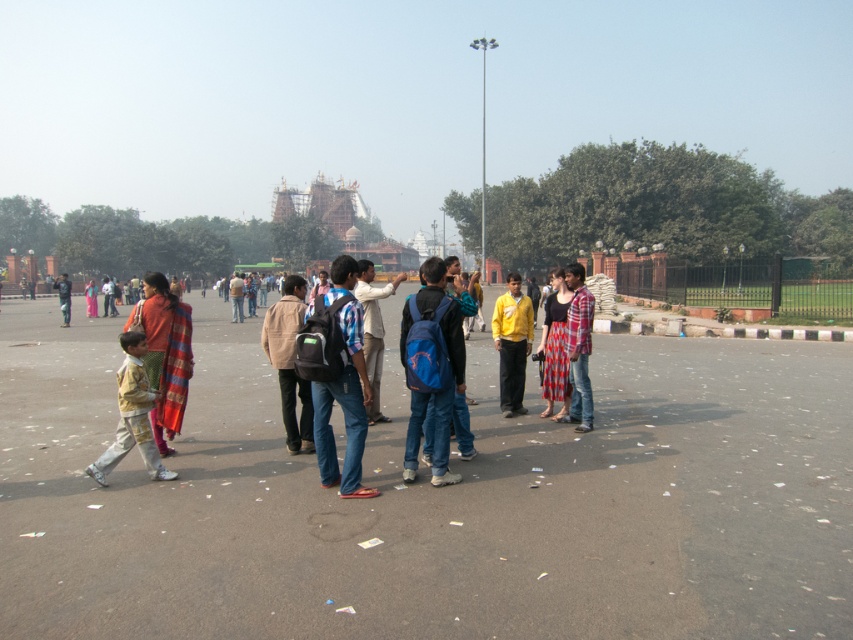
Is light yellow shirt at lower left smaller than plaid shirt at center?

No.

Which is in front, point (103, 468) or point (575, 369)?

Point (103, 468)

I want to click on light yellow shirt at lower left, so click(x=132, y=413).

Find the location of a particular element. light yellow shirt at lower left is located at coordinates (132, 413).

Measure the distance between brown leather jacket at center and camera.

brown leather jacket at center and camera are 6.88 meters apart.

Consider the image. Which is above, brown leather jacket at center or dark blue jeans at center?

dark blue jeans at center is higher up.

Who is more forward, (289, 337) or (64, 292)?

Point (289, 337) is more forward.

Find the location of `brown leather jacket at center`. brown leather jacket at center is located at coordinates click(x=289, y=362).

Which of these two, blue fabric backpack at center or yellow matte shirt at center, stands shorter?

blue fabric backpack at center is shorter.

Can you confirm if blue fabric backpack at center is positioned above yellow matte shirt at center?

→ No.

Locate an element on the screen. This screenshot has height=640, width=853. blue fabric backpack at center is located at coordinates (448, 365).